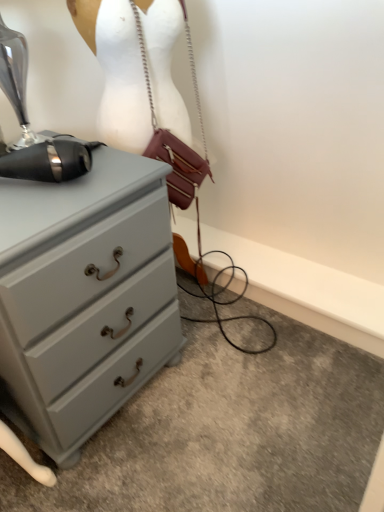
Image resolution: width=384 pixels, height=512 pixels. What are the coordinates of `vacant region to the right of matte gray chest of drawers at left` in the screenshot? It's located at (234, 400).